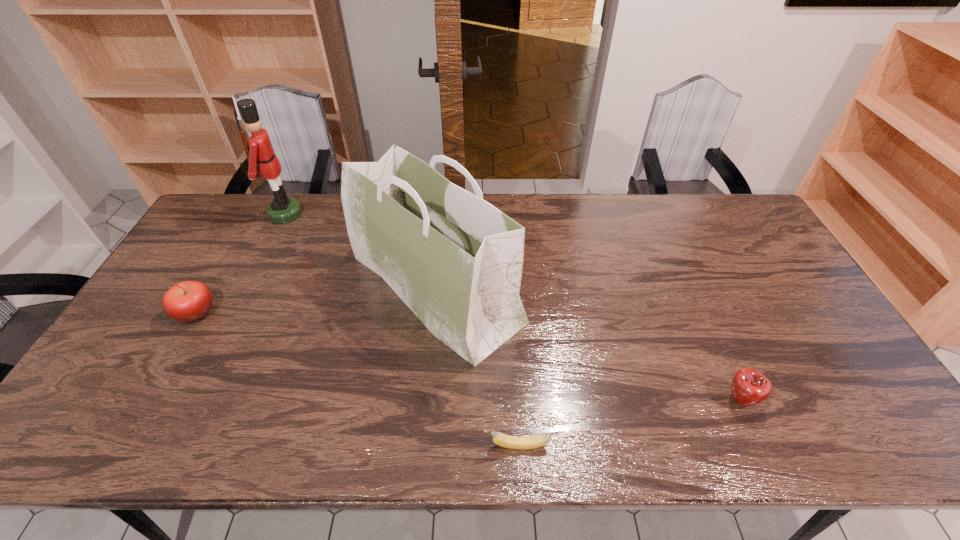
Locate an element on the screen. free space between the banana and the grocery bag is located at coordinates (476, 366).

Where is `vacant region between the nearest object and the rightmost object`? The height and width of the screenshot is (540, 960). vacant region between the nearest object and the rightmost object is located at coordinates (629, 422).

I want to click on free space between the farther apple and the grocery bag, so (x=317, y=300).

Select which object appears as the closest to the grocery bag. Please provide its 2D coordinates. Your answer should be formatted as a tuple, i.e. [(x, y)], where the tuple contains the x and y coordinates of a point satisfying the conditions above.

[(507, 441)]

Point out which object is positioned as the fourth nearest to the left apple. Please provide its 2D coordinates. Your answer should be formatted as a tuple, i.e. [(x, y)], where the tuple contains the x and y coordinates of a point satisfying the conditions above.

[(749, 387)]

Where is `vacant point that satisfies the following two spatial constraints: 1. on the front-facing side of the nutcracker; 2. on the back side of the rightmost object`? This screenshot has height=540, width=960. vacant point that satisfies the following two spatial constraints: 1. on the front-facing side of the nutcracker; 2. on the back side of the rightmost object is located at coordinates (194, 400).

The image size is (960, 540). What are the coordinates of `vacant space that satisfies the following two spatial constraints: 1. on the front-facing side of the farthest object; 2. on the front side of the farther apple` in the screenshot? It's located at (237, 313).